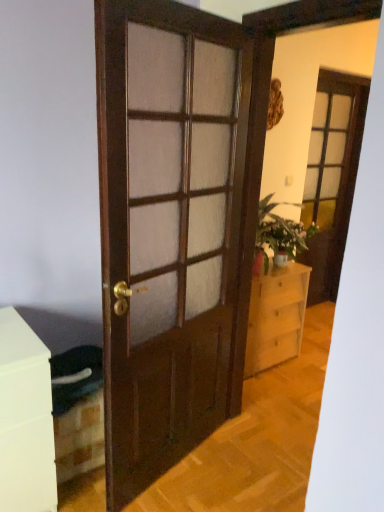
You are a GUI agent. You are given a task and a screenshot of the screen. Output one action in this format:
    pyautogui.click(x=<x>, y=<y>)
    Task: Click on the free space in front of matte glass screen door at upper right
    Image resolution: width=384 pixels, height=512 pixels.
    Given the screenshot: What is the action you would take?
    pyautogui.click(x=317, y=324)